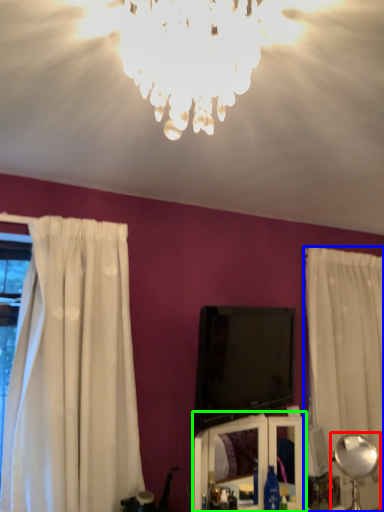
Question: Estimate the real-world distances between objects in this image. Which object is farther from lamp (highlighted by a red box), curtain (highlighted by a blue box) or vanity (highlighted by a green box)?

Choices:
 (A) curtain
 (B) vanity

Answer: (A)